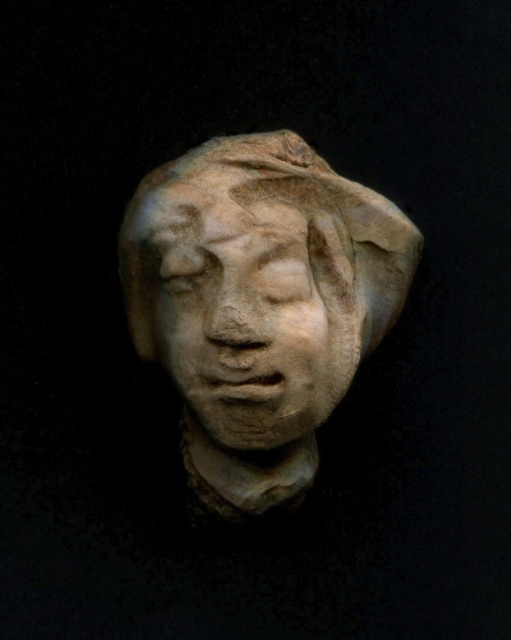
You are an art conservator examining the sculpture. You notice two points on the sculpture labeled point (180, 234) and point (240, 316). Which point is closer to your eyes?

Point (180, 234) is further to the viewer than point (240, 316), so point (180, 234) is closer to your eyes.

You are an art conservator examining the sculpture. You need to determine which part is closer to you for proper restoration. Which is closer to you, the matte stone head at center or the matte stone face at center?

The matte stone head at center is closer to you than the matte stone face at center, so you should focus your restoration efforts on the matte stone head at center first.

You are an art conservator examining a sculpture. The sculpture has a point marked at coordinates (259, 305). Where is the matte stone head located in relation to this point?

The matte stone head at center is located at point (259, 305).